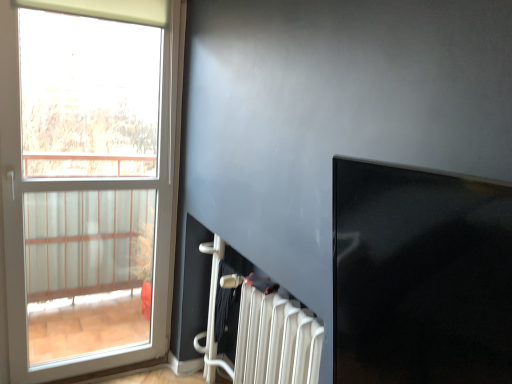
Question: Could you tell me if white plastic radiator at lower center is facing transparent glass window screen at upper right?

Choices:
 (A) no
 (B) yes

Answer: (A)

Question: Is white plastic radiator at lower center oriented away from transparent glass window screen at upper right?

Choices:
 (A) no
 (B) yes

Answer: (A)

Question: Is white plastic radiator at lower center further to camera compared to transparent glass window screen at upper right?

Choices:
 (A) yes
 (B) no

Answer: (A)

Question: Can you confirm if white plastic radiator at lower center is smaller than transparent glass window screen at upper right?

Choices:
 (A) yes
 (B) no

Answer: (B)

Question: Can you confirm if white plastic radiator at lower center is taller than transparent glass window screen at upper right?

Choices:
 (A) no
 (B) yes

Answer: (B)

Question: Is white plastic radiator at lower center bigger than transparent glass window screen at upper right?

Choices:
 (A) yes
 (B) no

Answer: (A)

Question: Does white glass window at left have a greater height compared to transparent glass window screen at upper right?

Choices:
 (A) yes
 (B) no

Answer: (A)

Question: Considering the relative sizes of white glass window at left and transparent glass window screen at upper right in the image provided, is white glass window at left thinner than transparent glass window screen at upper right?

Choices:
 (A) yes
 (B) no

Answer: (A)

Question: From a real-world perspective, is white glass window at left on top of transparent glass window screen at upper right?

Choices:
 (A) yes
 (B) no

Answer: (B)

Question: Can transparent glass window screen at upper right be found inside white glass window at left?

Choices:
 (A) yes
 (B) no

Answer: (B)

Question: From a real-world perspective, is white glass window at left under transparent glass window screen at upper right?

Choices:
 (A) yes
 (B) no

Answer: (A)

Question: Does white glass window at left have a lesser height compared to transparent glass window screen at upper right?

Choices:
 (A) no
 (B) yes

Answer: (A)

Question: Would you say transparent glass window screen at upper right is outside white plastic radiator at lower center?

Choices:
 (A) no
 (B) yes

Answer: (B)